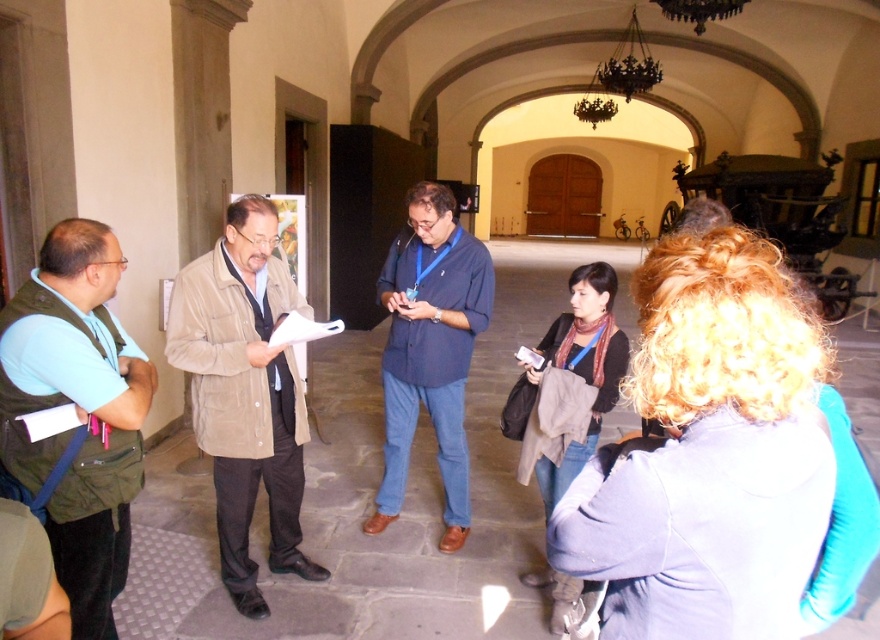
You are a GUI agent. You are given a task and a screenshot of the screen. Output one action in this format:
    pyautogui.click(x=<x>, y=<y>)
    Task: Click on the suede jacket at center
    
    Given the screenshot: What is the action you would take?
    pyautogui.click(x=246, y=392)

Does suede jacket at center appear over blue shirt at center?

Actually, suede jacket at center is below blue shirt at center.

Where is `suede jacket at center`? suede jacket at center is located at coordinates (246, 392).

Based on the photo, measure the distance between green fabric vest at left and blue shirt at center.

A distance of 4.77 feet exists between green fabric vest at left and blue shirt at center.

Is green fabric vest at left in front of blue shirt at center?

Yes, it is.

Locate an element on the screen. This screenshot has height=640, width=880. green fabric vest at left is located at coordinates (x=79, y=410).

Is green fabric vest at left closer to the viewer compared to suede jacket at center?

Yes, green fabric vest at left is in front of suede jacket at center.

The height and width of the screenshot is (640, 880). I want to click on green fabric vest at left, so click(x=79, y=410).